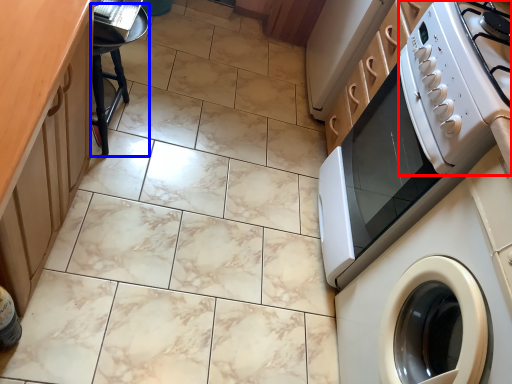
Question: Which object appears farthest to the camera in this image, gas stove (highlighted by a red box) or bar stool (highlighted by a blue box)?

Choices:
 (A) gas stove
 (B) bar stool

Answer: (B)